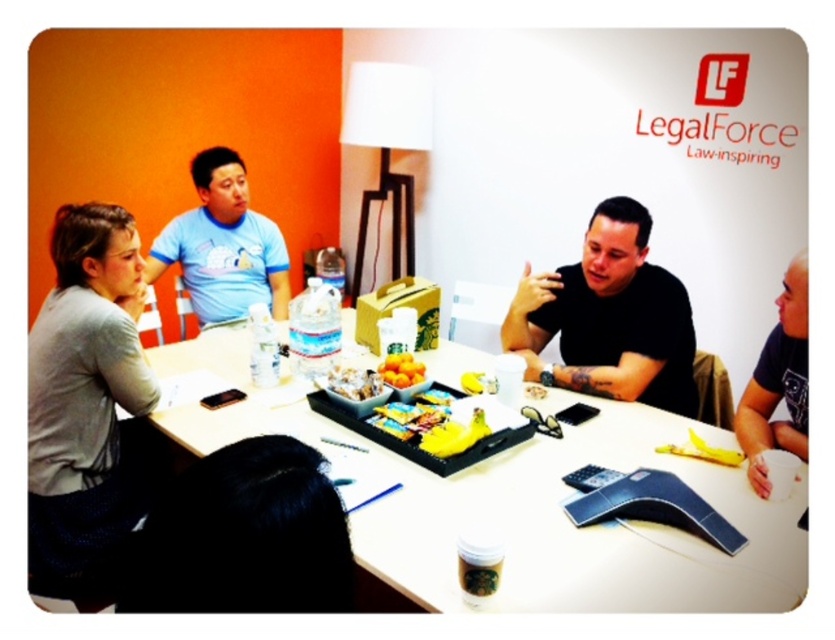
Question: Is dark blue t-shirt at right below white crumbly cake at center?

Choices:
 (A) no
 (B) yes

Answer: (A)

Question: Can you confirm if white glossy table at center is bigger than yellow matte oranges at center?

Choices:
 (A) no
 (B) yes

Answer: (B)

Question: Is white glossy table at center wider than dark blue t-shirt at right?

Choices:
 (A) yes
 (B) no

Answer: (A)

Question: Which of the following is the closest to the observer?

Choices:
 (A) white glossy table at center
 (B) white crumbly cake at center
 (C) black matte shirt at center
 (D) yellow matte oranges at center

Answer: (A)

Question: Which point is closer to the camera?

Choices:
 (A) light blue t-shirt at upper left
 (B) white crumbly cake at center

Answer: (B)

Question: Which point appears farthest from the camera in this image?

Choices:
 (A) (358, 380)
 (B) (573, 328)
 (C) (198, 256)

Answer: (C)